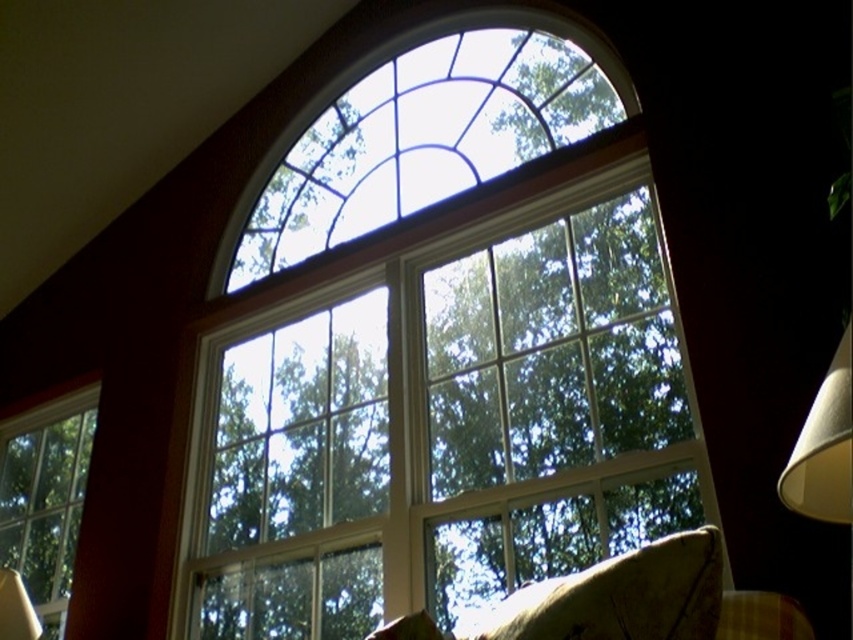
Question: Can you confirm if patterned fabric pillow at lower right is positioned to the right of clear glass window at lower left?

Choices:
 (A) no
 (B) yes

Answer: (B)

Question: Which of these objects is positioned farthest from the clear glass window at center?

Choices:
 (A) white paper lampshade at right
 (B) patterned fabric pillow at lower right

Answer: (A)

Question: Which point is farther to the camera?

Choices:
 (A) patterned fabric pillow at lower right
 (B) white paper lampshade at right
 (C) clear glass window at center
 (D) clear glass window at lower left

Answer: (D)

Question: Is patterned fabric pillow at lower right to the left of clear glass window at lower left from the viewer's perspective?

Choices:
 (A) no
 (B) yes

Answer: (A)

Question: Where is patterned fabric pillow at lower right located in relation to clear glass window at lower left in the image?

Choices:
 (A) right
 (B) left

Answer: (A)

Question: Which point is farther to the camera?

Choices:
 (A) clear glass window at center
 (B) white paper lampshade at right
 (C) clear glass window at lower left

Answer: (C)